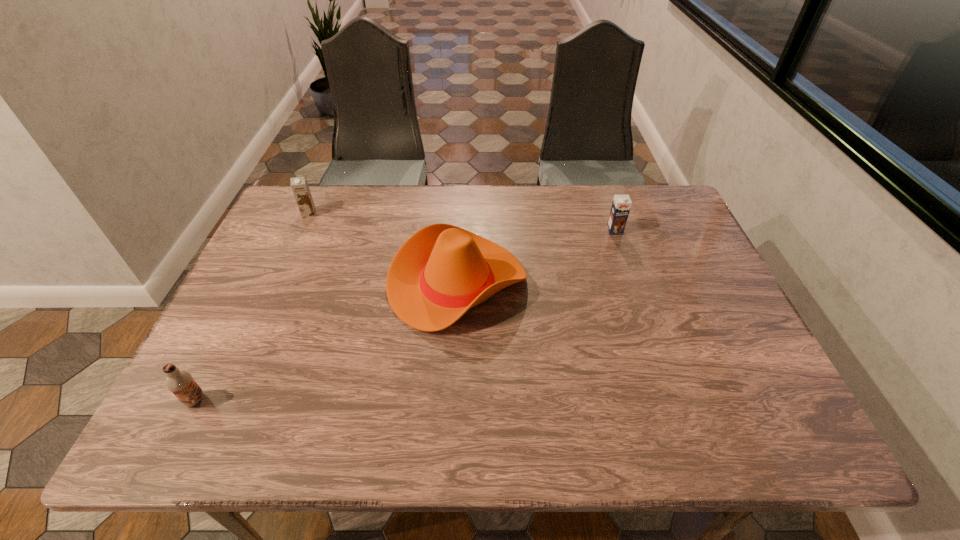
Where is `the third object from left to right`? the third object from left to right is located at coordinates (440, 272).

I want to click on cowboy hat, so click(x=440, y=272).

The width and height of the screenshot is (960, 540). In order to click on the third object from right to left in this screenshot , I will do `click(299, 185)`.

I want to click on the farthest chocolate milk, so click(x=299, y=185).

This screenshot has width=960, height=540. I want to click on the second farthest chocolate milk, so click(x=621, y=205).

Find the location of a particular element. The image size is (960, 540). the rightmost object is located at coordinates (621, 205).

What are the coordinates of `the nearest chocolate milk` in the screenshot? It's located at (180, 382).

You are a GUI agent. You are given a task and a screenshot of the screen. Output one action in this format:
    pyautogui.click(x=<x>, y=<y>)
    Task: Click on the leftmost object
    The height and width of the screenshot is (540, 960).
    Given the screenshot: What is the action you would take?
    pyautogui.click(x=180, y=382)

Identify the location of vacant position located 0.150m on the front of the cowboy hat. This screenshot has height=540, width=960. (452, 394).

Find the location of a particular element. The width and height of the screenshot is (960, 540). free region located 0.250m on the right of the third object from right to left is located at coordinates (397, 214).